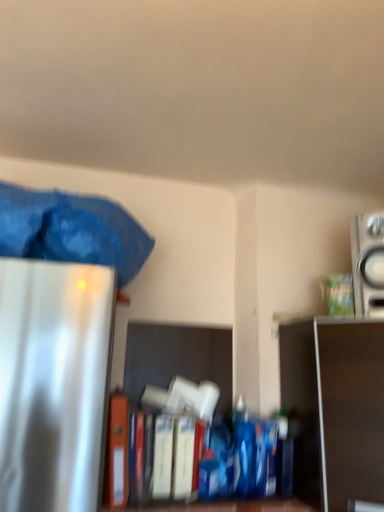
In order to click on metallic silver shelf at right in this screenshot , I will do `click(335, 409)`.

Identify the location of blue fabric bag at upper left. (71, 230).

Locate an element on the screen. This screenshot has height=512, width=384. metallic silver shelf at right is located at coordinates (335, 409).

Is orange matte file folder at center positioned beyond the bounds of silver metallic speaker at upper right?

orange matte file folder at center is positioned outside silver metallic speaker at upper right.

This screenshot has height=512, width=384. I want to click on appliance above the orange matte file folder at center (from a real-world perspective), so click(x=368, y=263).

Is orange matte file folder at center wider or thinner than silver metallic speaker at upper right?

Clearly, orange matte file folder at center has more width compared to silver metallic speaker at upper right.

From the image's perspective, is blue fabric bag at upper left positioned above or below orange matte file folder at center?

blue fabric bag at upper left is situated higher than orange matte file folder at center in the image.

Can you confirm if blue fabric bag at upper left is shorter than orange matte file folder at center?

Yes, blue fabric bag at upper left is shorter than orange matte file folder at center.

Is blue fabric bag at upper left bigger than orange matte file folder at center?

Yes, blue fabric bag at upper left is bigger than orange matte file folder at center.

From the image's perspective, is metallic silver shelf at right located above or below blue fabric bag at upper left?

Based on their image positions, metallic silver shelf at right is located beneath blue fabric bag at upper left.

Is metallic silver shelf at right located outside blue fabric bag at upper left?

metallic silver shelf at right is positioned outside blue fabric bag at upper left.

Relative to blue fabric bag at upper left, is metallic silver shelf at right in front or behind?

In the image, metallic silver shelf at right appears behind blue fabric bag at upper left.

Can you confirm if metallic silver shelf at right is positioned to the left of blue fabric bag at upper left?

Incorrect, metallic silver shelf at right is not on the left side of blue fabric bag at upper left.

Is blue fabric bag at upper left spatially inside silver metallic speaker at upper right, or outside of it?

blue fabric bag at upper left is spatially situated outside silver metallic speaker at upper right.

Based on the photo, considering the positions of objects blue fabric bag at upper left and silver metallic speaker at upper right in the image provided, who is more to the left, blue fabric bag at upper left or silver metallic speaker at upper right?

A: From the viewer's perspective, blue fabric bag at upper left appears more on the left side.

From a real-world perspective, which is physically above, blue fabric bag at upper left or silver metallic speaker at upper right?

In real-world perspective, silver metallic speaker at upper right is above.

Does metallic silver shelf at right have a larger size compared to silver metallic speaker at upper right?

Yes, metallic silver shelf at right is bigger than silver metallic speaker at upper right.

Is metallic silver shelf at right oriented towards silver metallic speaker at upper right?

No, metallic silver shelf at right is not aimed at silver metallic speaker at upper right.

Considering the positions of points (326, 362) and (360, 305), is point (326, 362) farther from camera compared to point (360, 305)?

No, it is in front of (360, 305).

From a real-world perspective, relative to silver metallic speaker at upper right, is metallic silver shelf at right vertically above or below?

metallic silver shelf at right is below silver metallic speaker at upper right.

Is orange matte file folder at center positioned with its back to metallic silver shelf at right?

No, orange matte file folder at center's orientation is not away from metallic silver shelf at right.

Does orange matte file folder at center have a greater height compared to metallic silver shelf at right?

No, orange matte file folder at center is not taller than metallic silver shelf at right.

Is orange matte file folder at center located outside metallic silver shelf at right?

Absolutely, orange matte file folder at center is external to metallic silver shelf at right.

Is there a large distance between orange matte file folder at center and metallic silver shelf at right?

They are positioned close to each other.

Is blue fabric bag at upper left inside silver metallic speaker at upper right?

That's incorrect, blue fabric bag at upper left is not inside silver metallic speaker at upper right.

From the picture: From a real-world perspective, is silver metallic speaker at upper right located higher than blue fabric bag at upper left?

Yes, from a real-world perspective, silver metallic speaker at upper right is over blue fabric bag at upper left

Is point (354, 246) closer to viewer compared to point (102, 262)?

No, (354, 246) is behind (102, 262).

Does silver metallic speaker at upper right have a lesser width compared to blue fabric bag at upper left?

Indeed, silver metallic speaker at upper right has a lesser width compared to blue fabric bag at upper left.

The image size is (384, 512). There is a orange matte file folder at center. Find the location of `appliance above it (from a real-world perspective)`. appliance above it (from a real-world perspective) is located at coordinates (368, 263).

Locate an element on the screen. The image size is (384, 512). waste that is in front of the orange matte file folder at center is located at coordinates [71, 230].

From the image, which object appears to be nearer to metallic silver shelf at right, silver metallic speaker at upper right or orange matte file folder at center?

silver metallic speaker at upper right is closer to metallic silver shelf at right.

Which object lies further to the anchor point metallic silver shelf at right, blue fabric bag at upper left or orange matte file folder at center?

The object further to metallic silver shelf at right is blue fabric bag at upper left.

Based on the photo, considering their positions, is silver metallic speaker at upper right positioned further to blue fabric bag at upper left than orange matte file folder at center?

silver metallic speaker at upper right lies further to blue fabric bag at upper left than the other object.

Which object lies nearer to the anchor point blue fabric bag at upper left, orange matte file folder at center or metallic silver shelf at right?

orange matte file folder at center lies closer to blue fabric bag at upper left than the other object.

Looking at the image, which one is located closer to orange matte file folder at center, metallic silver shelf at right or blue fabric bag at upper left?

blue fabric bag at upper left is closer to orange matte file folder at center.

Looking at the image, which one is located further to silver metallic speaker at upper right, blue fabric bag at upper left or metallic silver shelf at right?

blue fabric bag at upper left lies further to silver metallic speaker at upper right than the other object.

From the image, which object appears to be farther from blue fabric bag at upper left, orange matte file folder at center or silver metallic speaker at upper right?

The object further to blue fabric bag at upper left is silver metallic speaker at upper right.

Estimate the real-world distances between objects in this image. Which object is closer to metallic silver shelf at right, orange matte file folder at center or blue fabric bag at upper left?

orange matte file folder at center.

I want to click on shelf situated between orange matte file folder at center and silver metallic speaker at upper right from left to right, so click(335, 409).

You are a GUI agent. You are given a task and a screenshot of the screen. Output one action in this format:
    pyautogui.click(x=<x>, y=<y>)
    Task: Click on the book located between blue fabric bag at upper left and silver metallic speaker at upper right in the left-right direction
    The image size is (384, 512).
    Given the screenshot: What is the action you would take?
    [x=117, y=452]

Image resolution: width=384 pixels, height=512 pixels. I want to click on shelf between blue fabric bag at upper left and silver metallic speaker at upper right in the horizontal direction, so click(335, 409).

This screenshot has height=512, width=384. I want to click on book between blue fabric bag at upper left and metallic silver shelf at right from left to right, so click(117, 452).